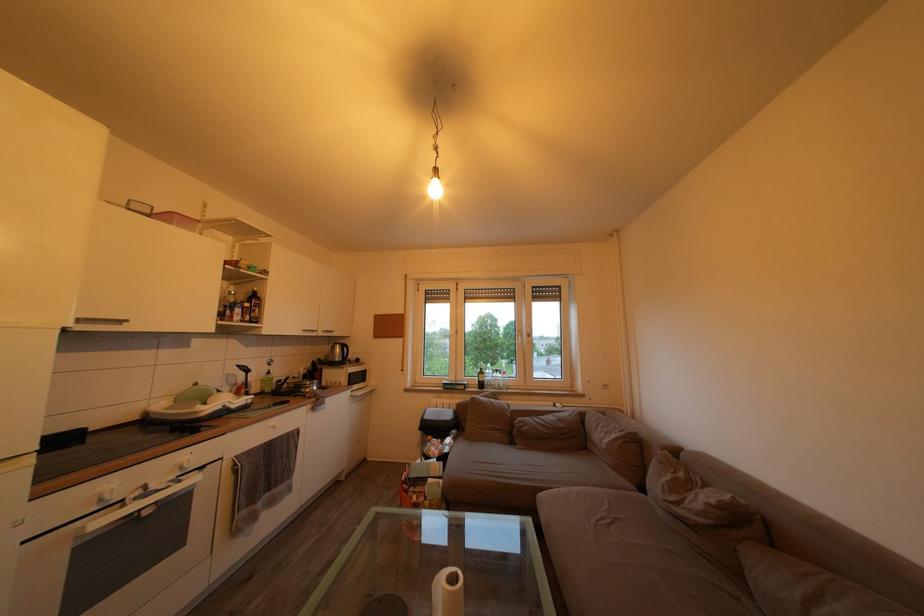
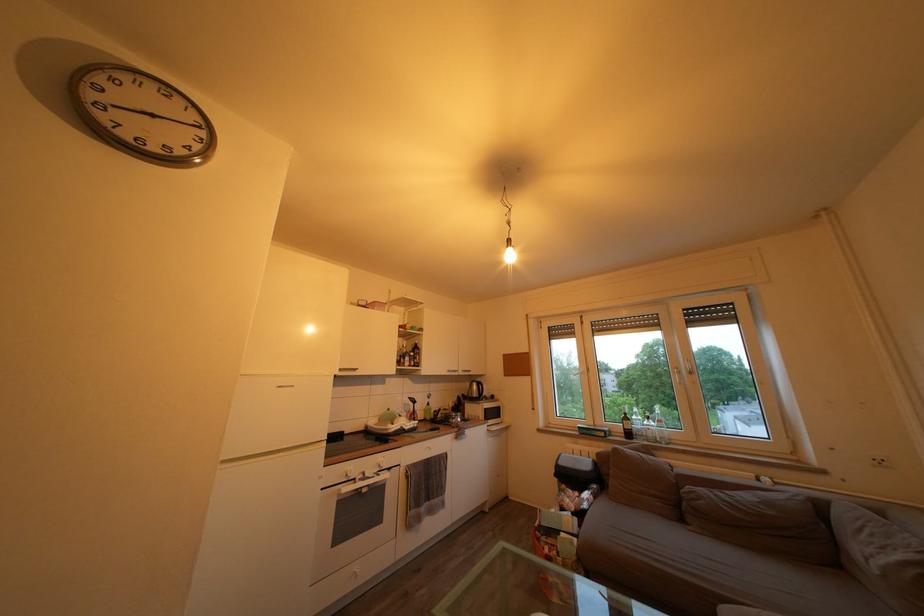
The point at (490, 379) is marked in the first image. Where is the corresponding point in the second image?

(635, 424)